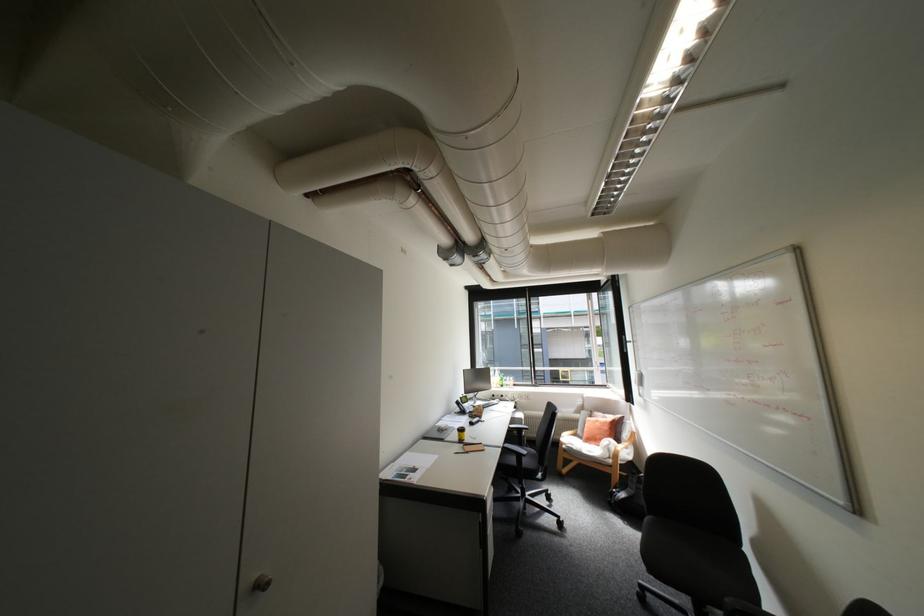
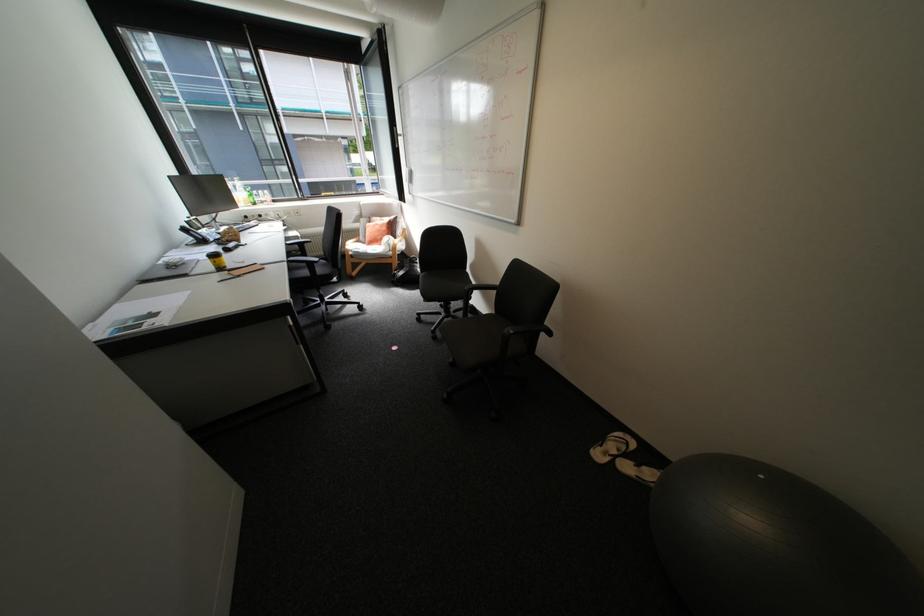
Where in the second image is the point corresponding to point (450, 424) from the first image?

(176, 260)